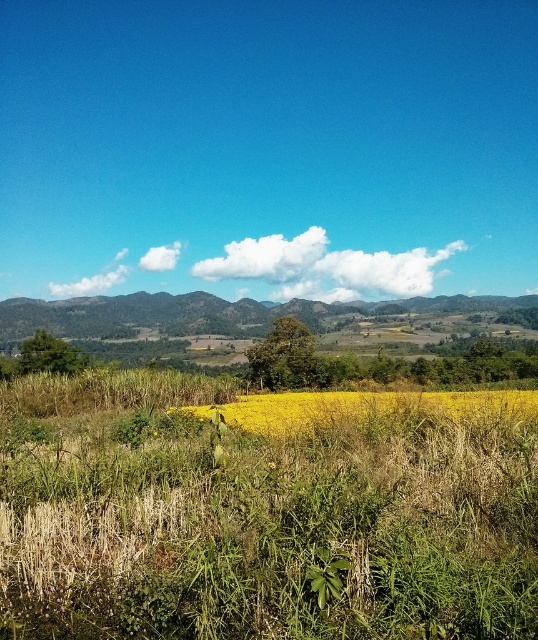
From the picture: You are an airplane pilot flying over a rural area and you notice a white fluffy cloud at upper center and yellow grass at center. Which one is larger in size?

The white fluffy cloud at upper center is bigger than the yellow grass at center.

You are a farmer inspecting your field and notice two plants at the center of the field. You see the yellow grass at center and the green leafy weed at center. Which plant is taller?

The yellow grass at center is much taller than the green leafy weed at center according to the description.